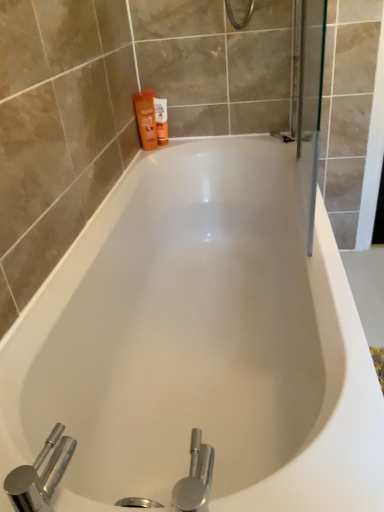
The height and width of the screenshot is (512, 384). Identify the location of vacant area that is situated to the right of orange matte bottle at upper left, placed as the 1th toiletry when sorted from left to right. (196, 143).